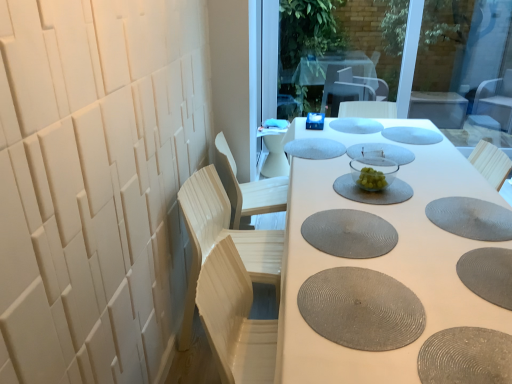
Locate an element on the screen. The width and height of the screenshot is (512, 384). free space behind clear glass bowl at center, the sixth manhole cover positioned from the front is located at coordinates coord(339,161).